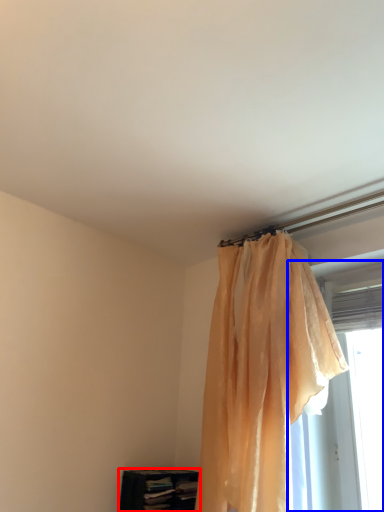
Question: Which object is further to the camera taking this photo, furniture (highlighted by a red box) or window (highlighted by a blue box)?

Choices:
 (A) furniture
 (B) window

Answer: (A)